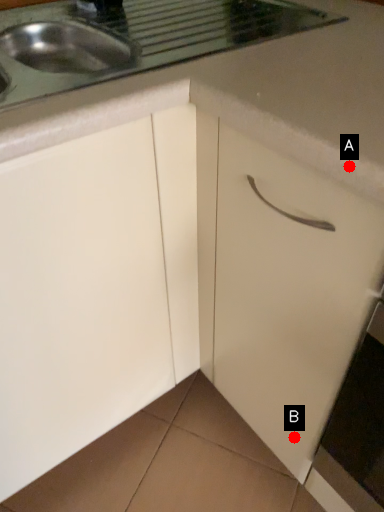
Question: Two points are circled on the image, labeled by A and B beside each circle. Which point is closer to the camera taking this photo?

Choices:
 (A) A is closer
 (B) B is closer

Answer: (A)